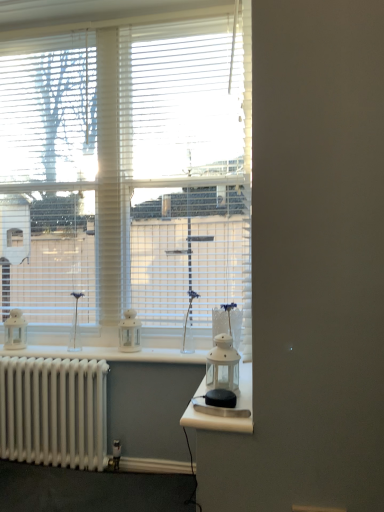
I want to click on empty space that is ontop of white plastic blinds at upper left (from a real-world perspective), so click(48, 35).